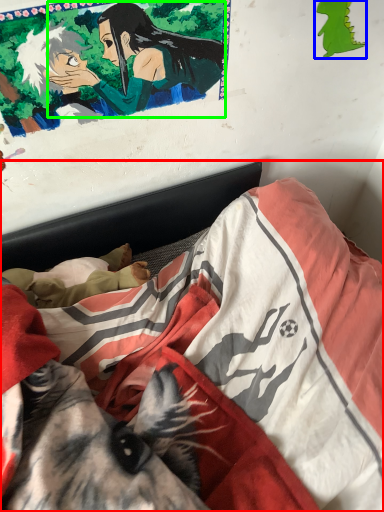
Question: Which is nearer to the bed (highlighted by a red box)? art (highlighted by a blue box) or woman (highlighted by a green box).

Choices:
 (A) art
 (B) woman

Answer: (B)